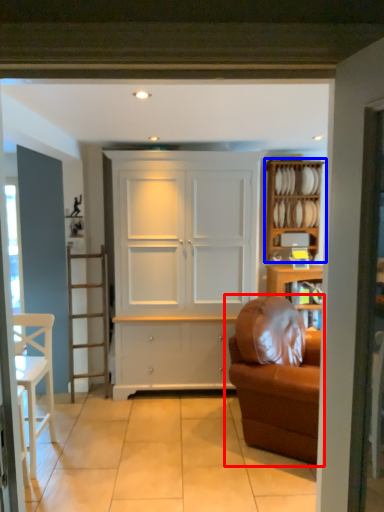
Question: Which of the following is the closest to the observer, studio couch (highlighted by a red box) or shelf (highlighted by a blue box)?

Choices:
 (A) studio couch
 (B) shelf

Answer: (A)